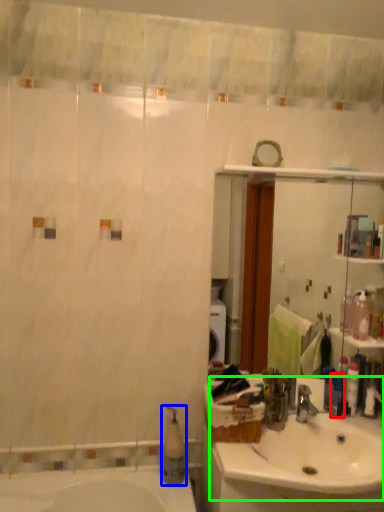
Question: Based on their relative distances, which object is nearer to toiletry (highlighted by a red box)? Choose from soap dispenser (highlighted by a blue box) and sink (highlighted by a green box).

Choices:
 (A) soap dispenser
 (B) sink

Answer: (B)